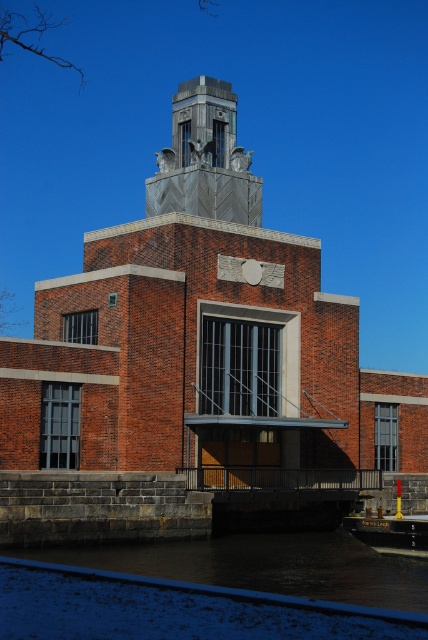
You are a tourist standing at the entrance of the historic building and want to take a photo of the metallic gray bell tower at center and the dark water at lower center. Where should you position yourself to capture both elements in the frame?

You should position yourself in a spot where the metallic gray bell tower at center is above the dark water at lower center, as the dark water at lower center is positioned under the metallic gray bell tower at center.

You are an architect analyzing the building. The brick building at center and metallic gray bell tower at center are both part of the structure. Which one is taller?

The brick building at center is taller than the metallic gray bell tower at center.

You are standing on a bridge overlooking the brick building at center and the dark water at lower center. Which object is closer to you?

The brick building at center is closer to you than the dark water at lower center because it is positioned further to the viewer.